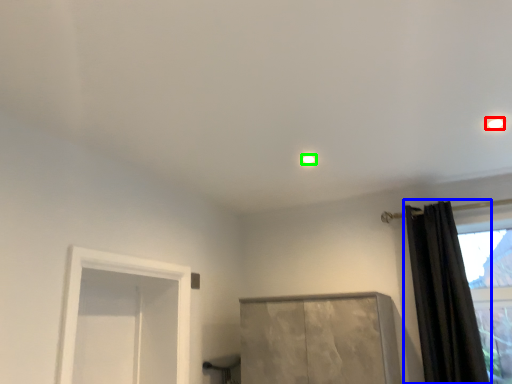
Question: Which object is positioned closest to lighting (highlighted by a red box)? Select from curtain (highlighted by a blue box) and lighting (highlighted by a green box).

Choices:
 (A) curtain
 (B) lighting

Answer: (B)